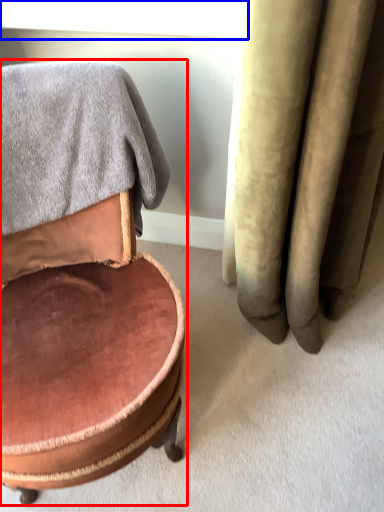
Question: Which point is closer to the camera, chair (highlighted by a red box) or window screen (highlighted by a blue box)?

Choices:
 (A) chair
 (B) window screen

Answer: (A)